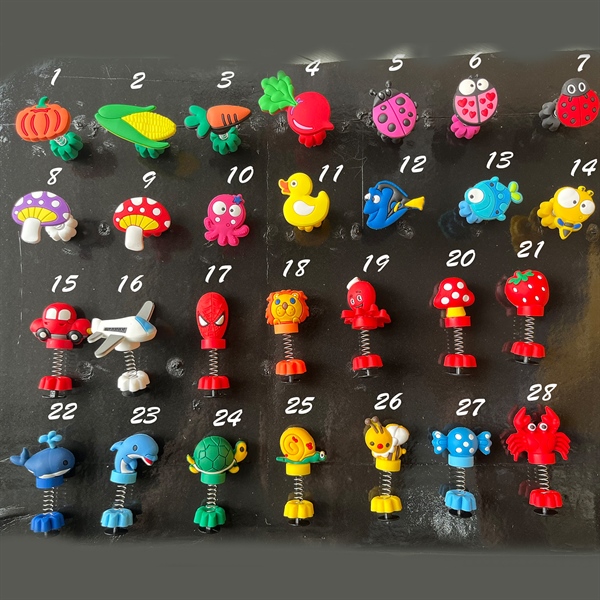
Identify the location of last row of toys. (42, 459), (133, 453), (206, 454), (292, 448), (380, 443), (459, 443), (530, 439).